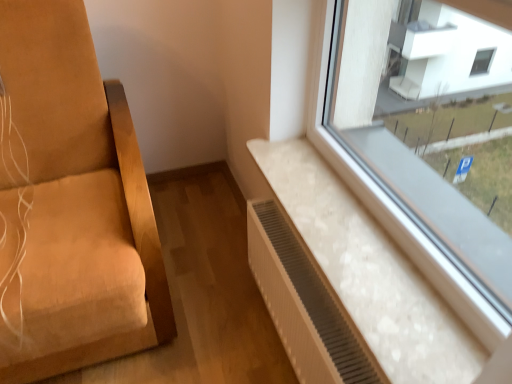
Question: Considering the relative positions of white textured radiator at lower right and white marble radiator at lower right in the image provided, is white textured radiator at lower right to the left of white marble radiator at lower right from the viewer's perspective?

Choices:
 (A) yes
 (B) no

Answer: (A)

Question: Does white textured radiator at lower right contain white marble radiator at lower right?

Choices:
 (A) yes
 (B) no

Answer: (B)

Question: Can you confirm if white textured radiator at lower right is taller than white marble radiator at lower right?

Choices:
 (A) no
 (B) yes

Answer: (B)

Question: Is white textured radiator at lower right looking in the opposite direction of white marble radiator at lower right?

Choices:
 (A) no
 (B) yes

Answer: (A)

Question: From the image's perspective, is white textured radiator at lower right on top of white marble radiator at lower right?

Choices:
 (A) yes
 (B) no

Answer: (B)

Question: Is white textured radiator at lower right further to camera compared to white marble radiator at lower right?

Choices:
 (A) no
 (B) yes

Answer: (B)

Question: Does white marble radiator at lower right have a lesser height compared to white textured radiator at lower right?

Choices:
 (A) yes
 (B) no

Answer: (A)

Question: From a real-world perspective, is white marble radiator at lower right positioned under white textured radiator at lower right based on gravity?

Choices:
 (A) no
 (B) yes

Answer: (A)

Question: Does white marble radiator at lower right come behind white textured radiator at lower right?

Choices:
 (A) yes
 (B) no

Answer: (B)

Question: Is white marble radiator at lower right facing away from white textured radiator at lower right?

Choices:
 (A) no
 (B) yes

Answer: (A)

Question: Can you confirm if white marble radiator at lower right is thinner than white textured radiator at lower right?

Choices:
 (A) no
 (B) yes

Answer: (A)

Question: Is white marble radiator at lower right smaller than white textured radiator at lower right?

Choices:
 (A) yes
 (B) no

Answer: (A)

Question: In the image, is white textured radiator at lower right on the left side or the right side of white marble radiator at lower right?

Choices:
 (A) right
 (B) left

Answer: (B)